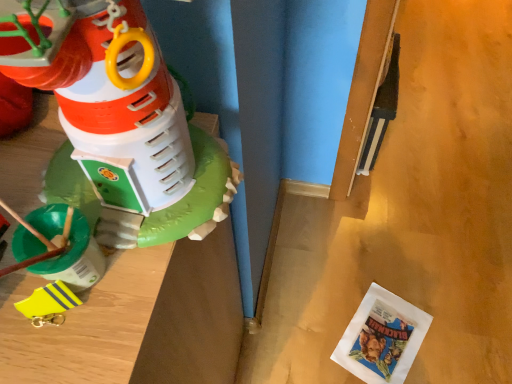
Identify the location of blank space situated above white paper comic book at lower right (from a real-world perspective). (382, 337).